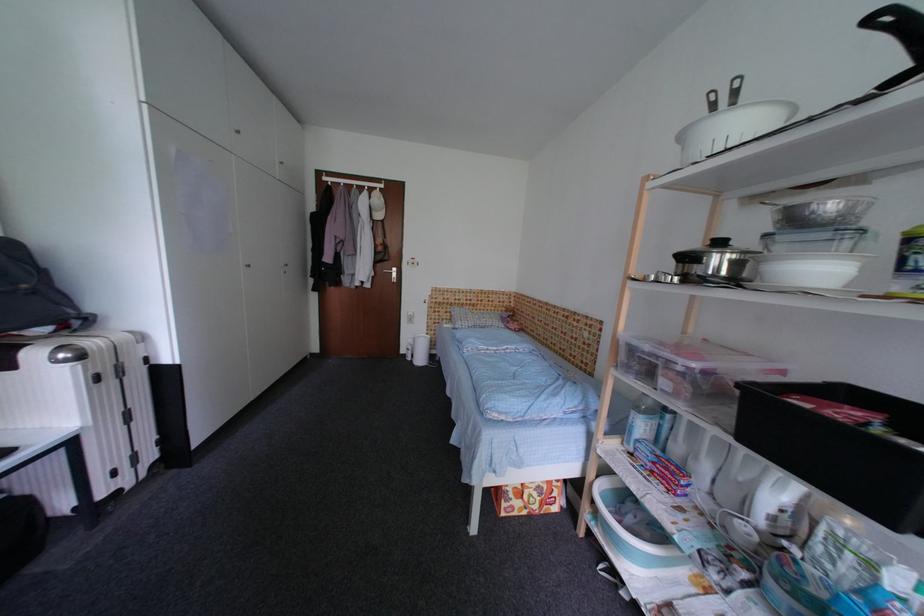
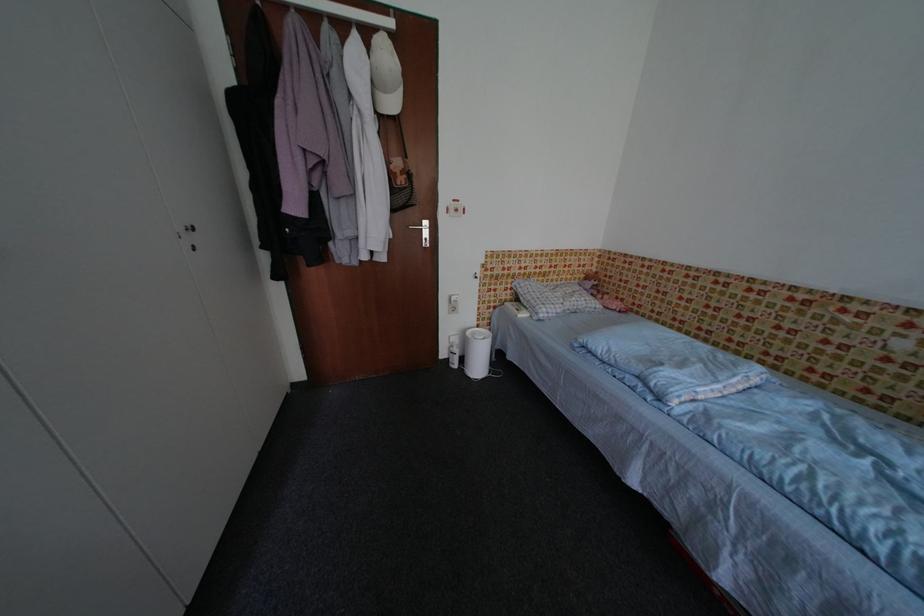
Locate, in the second image, the point that corresponds to point (412, 358) in the first image.

(455, 363)